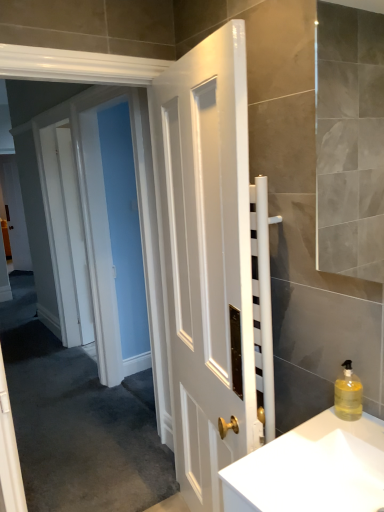
The image size is (384, 512). In order to click on free space in front of translucent yellow liquid at right in this screenshot , I will do `click(349, 431)`.